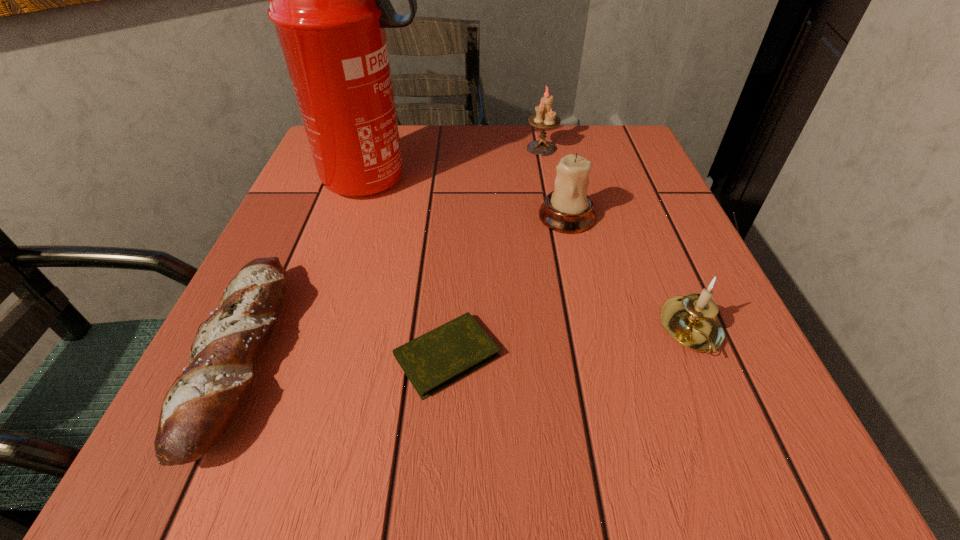
You are a GUI agent. You are given a task and a screenshot of the screen. Output one action in this format:
    pyautogui.click(x=<x>, y=<y>)
    Task: Click on the vacant point located between the second farthest candle holder and the fire extinguisher
    The height and width of the screenshot is (540, 960).
    Given the screenshot: What is the action you would take?
    pyautogui.click(x=471, y=198)

I want to click on empty space between the baguet and the shortest object, so click(345, 356).

The width and height of the screenshot is (960, 540). Find the location of `vacant region between the second shortest object and the second nearest candle holder`. vacant region between the second shortest object and the second nearest candle holder is located at coordinates (404, 286).

You are a GUI agent. You are given a task and a screenshot of the screen. Output one action in this format:
    pyautogui.click(x=<x>, y=<y>)
    Task: Click on the object that is the nearest to the tallest object
    
    Given the screenshot: What is the action you would take?
    pyautogui.click(x=200, y=405)

Point out which object is positioned as the fifth nearest to the diary. Please provide its 2D coordinates. Your answer should be formatted as a tuple, i.e. [(x, y)], where the tuple contains the x and y coordinates of a point satisfying the conditions above.

[(545, 118)]

Locate an element on the screen. candle holder that is the second closest to the rightmost candle holder is located at coordinates (545, 118).

Identify which candle holder is located as the second nearest to the shortest object. Please provide its 2D coordinates. Your answer should be formatted as a tuple, i.e. [(x, y)], where the tuple contains the x and y coordinates of a point satisfying the conditions above.

[(691, 320)]

Find the location of a particular element. vacant region that satisfies the following two spatial constraints: 1. on the trigger side of the fire extinguisher; 2. on the front side of the second shortest object is located at coordinates (322, 356).